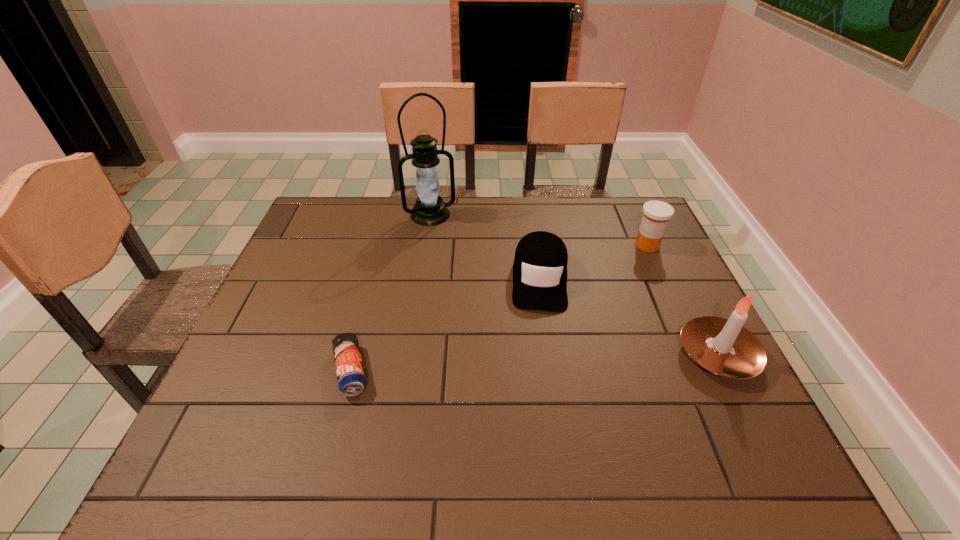
Find the location of a particular element. free space at the near right corner of the desktop is located at coordinates (732, 394).

Image resolution: width=960 pixels, height=540 pixels. In order to click on free space between the medicine and the beer can in this screenshot , I will do `click(499, 308)`.

Where is `vacant point located between the farthest object and the third object from right to left`? vacant point located between the farthest object and the third object from right to left is located at coordinates (485, 247).

In order to click on unoccupied position between the second tallest object and the cap in this screenshot , I will do `click(629, 317)`.

Image resolution: width=960 pixels, height=540 pixels. What are the coordinates of `free spot between the second tallest object and the farthest object` in the screenshot? It's located at (574, 285).

This screenshot has height=540, width=960. In order to click on vacant region between the tallest object and the candle in this screenshot , I will do `click(574, 285)`.

Find the location of `free area in between the candle and the beer can`. free area in between the candle and the beer can is located at coordinates (534, 363).

Where is `vacant area between the beer can and the candle`? The height and width of the screenshot is (540, 960). vacant area between the beer can and the candle is located at coordinates (534, 363).

What are the coordinates of `free space that is in between the farthest object and the shortest object` in the screenshot? It's located at (391, 293).

Find the location of a particular element. The image size is (960, 540). vacant area that lies between the third object from left to right and the candle is located at coordinates (629, 317).